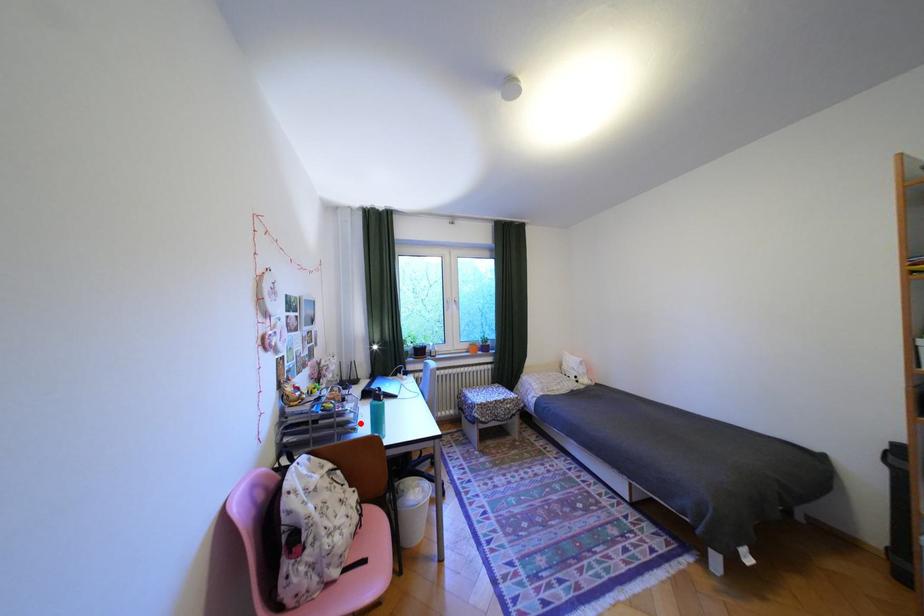
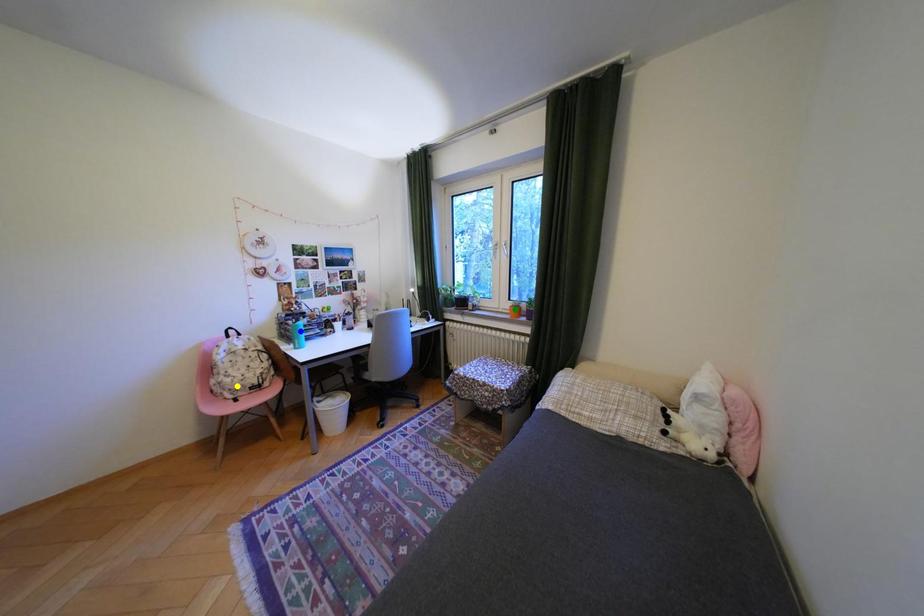
Question: I am providing you with two images of the same scene from different viewpoints. A red point is marked on the first image. You are given multiple points on the second image. Which point in image 2 represents the same 3d spot as the red point in image 1?

Choices:
 (A) blue point
 (B) yellow point
 (C) green point

Answer: (A)